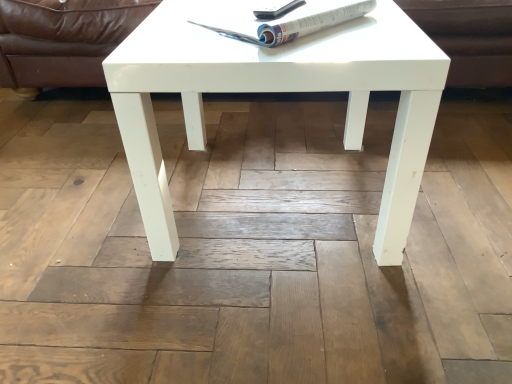
Question: Can you confirm if white glossy magazine at upper center is shorter than white glossy coffee table at center?

Choices:
 (A) no
 (B) yes

Answer: (B)

Question: Can you confirm if white glossy magazine at upper center is bigger than white glossy coffee table at center?

Choices:
 (A) yes
 (B) no

Answer: (B)

Question: Does white glossy magazine at upper center have a greater width compared to white glossy coffee table at center?

Choices:
 (A) yes
 (B) no

Answer: (B)

Question: Is white glossy magazine at upper center closer to camera compared to white glossy coffee table at center?

Choices:
 (A) no
 (B) yes

Answer: (A)

Question: From a real-world perspective, is white glossy magazine at upper center over white glossy coffee table at center?

Choices:
 (A) no
 (B) yes

Answer: (B)

Question: Considering the positions of brown leather couch at upper center and white glossy magazine at upper center in the image, is brown leather couch at upper center wider or thinner than white glossy magazine at upper center?

Choices:
 (A) wide
 (B) thin

Answer: (A)

Question: In terms of height, does brown leather couch at upper center look taller or shorter compared to white glossy magazine at upper center?

Choices:
 (A) tall
 (B) short

Answer: (A)

Question: Is brown leather couch at upper center situated inside white glossy magazine at upper center or outside?

Choices:
 (A) outside
 (B) inside

Answer: (A)

Question: In the image, is brown leather couch at upper center on the left side or the right side of white glossy magazine at upper center?

Choices:
 (A) left
 (B) right

Answer: (B)

Question: Which is correct: brown leather couch at upper center is inside white glossy coffee table at center, or outside of it?

Choices:
 (A) inside
 (B) outside

Answer: (B)

Question: Looking at the image, does brown leather couch at upper center seem bigger or smaller compared to white glossy coffee table at center?

Choices:
 (A) big
 (B) small

Answer: (A)

Question: From their relative heights in the image, would you say brown leather couch at upper center is taller or shorter than white glossy coffee table at center?

Choices:
 (A) short
 (B) tall

Answer: (A)

Question: Does point (459, 16) appear closer or farther from the camera than point (388, 51)?

Choices:
 (A) farther
 (B) closer

Answer: (A)

Question: From the image's perspective, is white glossy magazine at upper center located above or below brown leather couch at upper center?

Choices:
 (A) above
 (B) below

Answer: (B)

Question: In the image, is white glossy magazine at upper center on the left side or the right side of brown leather couch at upper center?

Choices:
 (A) right
 (B) left

Answer: (B)